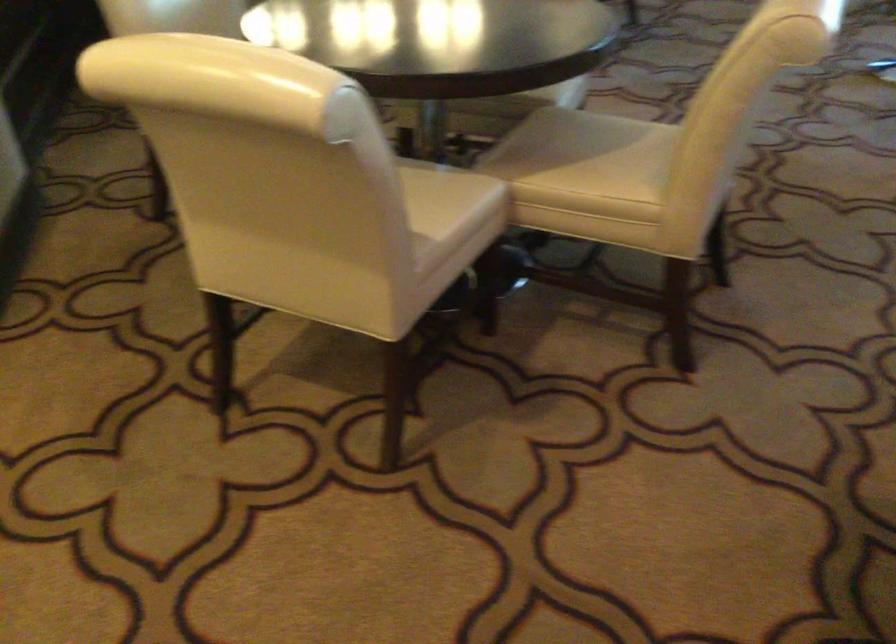
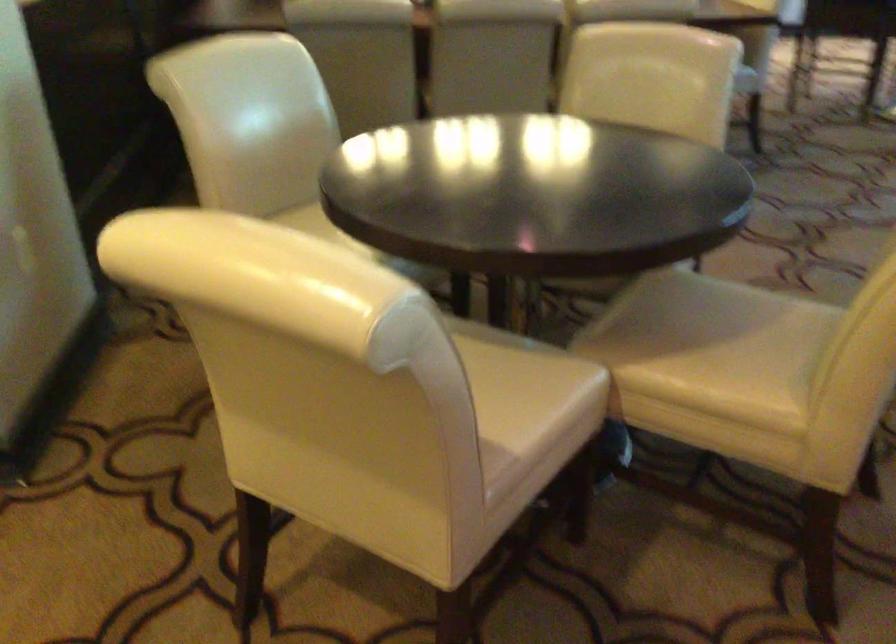
Where in the second image is the point corresponding to point 444,187 from the first image?

(530, 377)